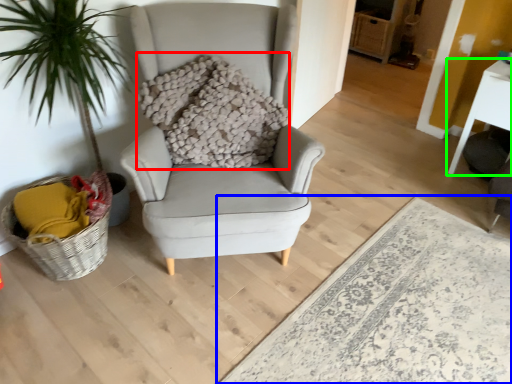
Question: Based on their relative distances, which object is nearer to pillow (highlighted by a red box)? Choose from plain (highlighted by a blue box) and table (highlighted by a green box).

Choices:
 (A) plain
 (B) table

Answer: (A)